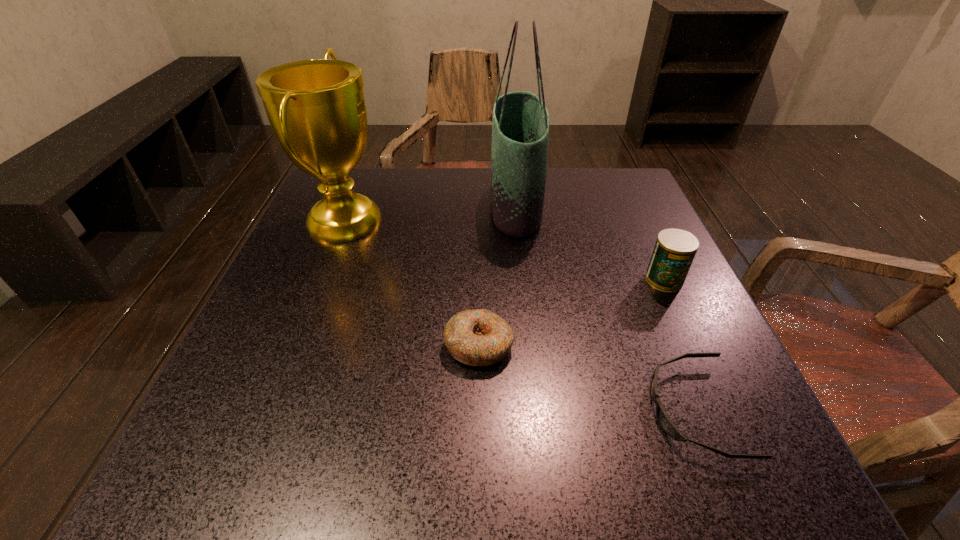
Where is `free location that satisfies the following two spatial constraints: 1. on the shiny surface of the fourth tallest object; 2. on the right side of the leftmost object`? This screenshot has height=540, width=960. free location that satisfies the following two spatial constraints: 1. on the shiny surface of the fourth tallest object; 2. on the right side of the leftmost object is located at coordinates (295, 345).

The width and height of the screenshot is (960, 540). In order to click on free region that satisfies the following two spatial constraints: 1. on the front side of the tote bag; 2. on the left side of the can in this screenshot , I will do `click(524, 280)`.

The image size is (960, 540). Identify the location of free space in the image that satisfies the following two spatial constraints: 1. on the front side of the tallest object; 2. on the shiny surface of the second tallest object. (517, 219).

Locate an element on the screen. This screenshot has width=960, height=540. vacant space that satisfies the following two spatial constraints: 1. on the shiny surface of the third tallest object; 2. on the right side of the leftmost object is located at coordinates (321, 280).